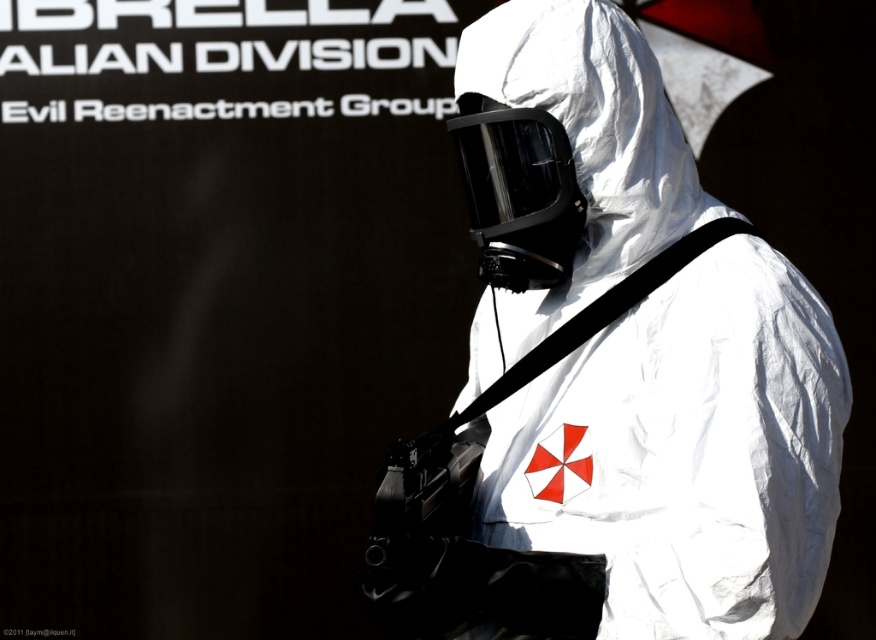
Question: Is white matte hazmat suit at center thinner than white matte helmet at center?

Choices:
 (A) yes
 (B) no

Answer: (B)

Question: Can you confirm if white matte hazmat suit at center is positioned to the right of white matte helmet at center?

Choices:
 (A) no
 (B) yes

Answer: (B)

Question: Can you confirm if white matte hazmat suit at center is bigger than white matte helmet at center?

Choices:
 (A) no
 (B) yes

Answer: (B)

Question: Which of the following is the closest to the observer?

Choices:
 (A) white matte hazmat suit at center
 (B) white matte helmet at center

Answer: (A)

Question: Among these objects, which one is nearest to the camera?

Choices:
 (A) white matte helmet at center
 (B) white matte hazmat suit at center

Answer: (B)